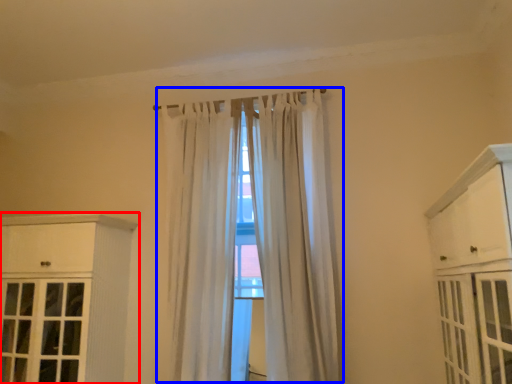
Question: Which object appears farthest to the camera in this image, cabinetry (highlighted by a red box) or curtain (highlighted by a blue box)?

Choices:
 (A) cabinetry
 (B) curtain

Answer: (B)